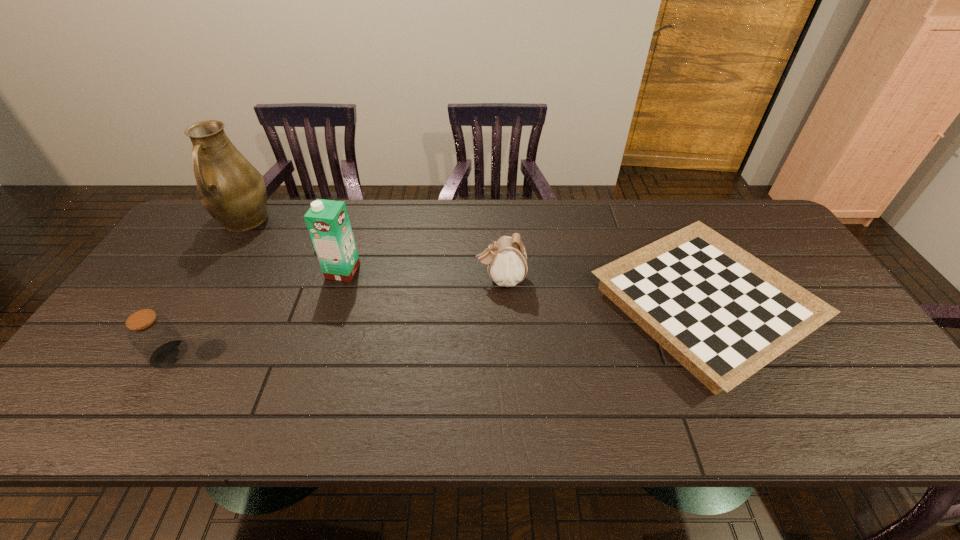
Find the location of a particular element. This screenshot has height=540, width=960. free space between the jar and the shortest object is located at coordinates (436, 330).

Where is `empty space that is in between the fourth shortest object and the pitcher`? This screenshot has width=960, height=540. empty space that is in between the fourth shortest object and the pitcher is located at coordinates (293, 246).

Locate an element on the screen. vacant space in between the checkerboard and the third object from left to right is located at coordinates (523, 288).

You are a GUI agent. You are given a task and a screenshot of the screen. Output one action in this format:
    pyautogui.click(x=<x>, y=<y>)
    Task: Click on the blank region between the fourth tallest object and the checkerboard
    This screenshot has width=960, height=540.
    Given the screenshot: What is the action you would take?
    coord(436,330)

The width and height of the screenshot is (960, 540). What are the coordinates of `free area in between the rightmost object and the pouch` in the screenshot? It's located at (x=602, y=293).

This screenshot has width=960, height=540. I want to click on free area in between the fourth object from left to right and the second shortest object, so click(x=335, y=317).

Where is `free space that is in between the tallest object and the second tallest object`? This screenshot has width=960, height=540. free space that is in between the tallest object and the second tallest object is located at coordinates (293, 246).

The image size is (960, 540). Find the location of `free space between the checkerboard and the third object from left to right`. free space between the checkerboard and the third object from left to right is located at coordinates (523, 288).

Identify which object is the nearest to the tallest object. Please provide its 2D coordinates. Your answer should be formatted as a tuple, i.e. [(x, y)], where the tuple contains the x and y coordinates of a point satisfying the conditions above.

[(328, 223)]

Point out which object is positioned as the second nearest to the rightmost object. Please provide its 2D coordinates. Your answer should be formatted as a tuple, i.e. [(x, y)], where the tuple contains the x and y coordinates of a point satisfying the conditions above.

[(328, 223)]